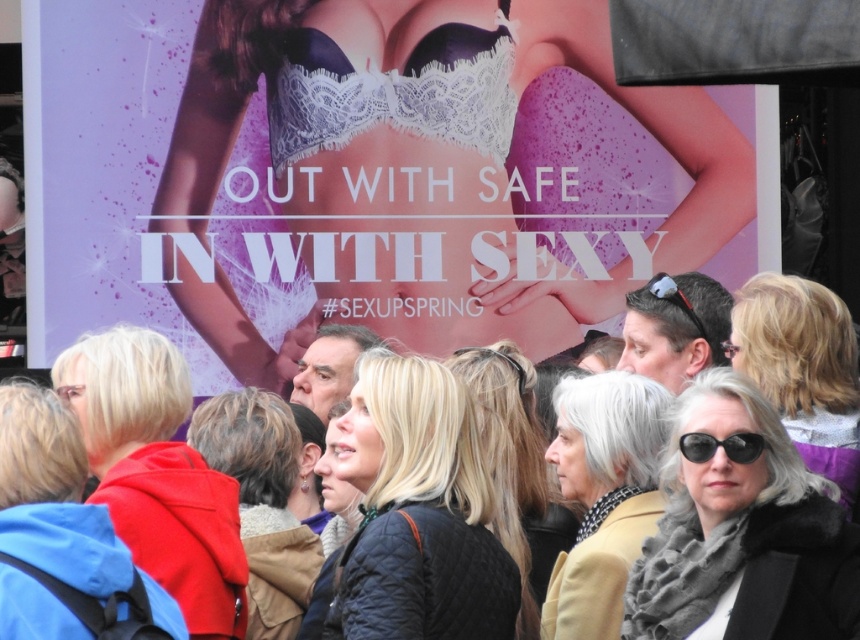
Looking at this image, you are a photographer trying to capture a clear shot of both the matte red hoodie at center and the white lace corset at upper center in the scene. Since you want to focus on the corset first, which object should you adjust your camera focus to first?

The white lace corset at upper center should be focused on first because it is positioned above the matte red hoodie at center, making it closer to the camera lens.

You are standing in front of the advertisement and want to take a photo of the dark brown textured coat at center. Where should you position yourself to capture it in the frame?

To capture the dark brown textured coat at center in the frame, position yourself so that the coat is centered at coordinates approximately 0.784 on the x and 0.307 on the y axis.

You are standing in front of the large advertisement and want to touch the point at coordinates (x=157, y=474). Which object in the scene will your hand contact?

The point at coordinates (x=157, y=474) is on the matte red hoodie at center, so your hand will contact the matte red hoodie at center.